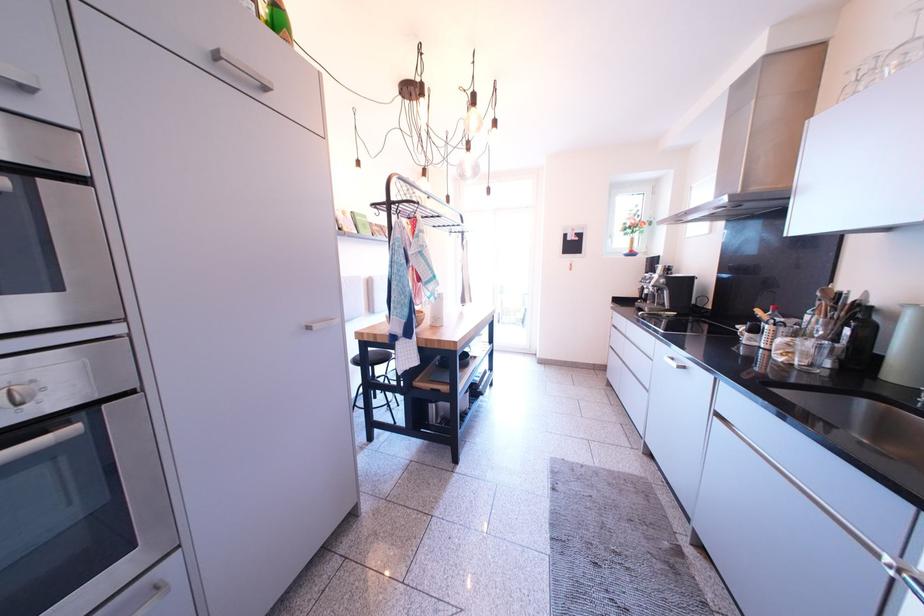
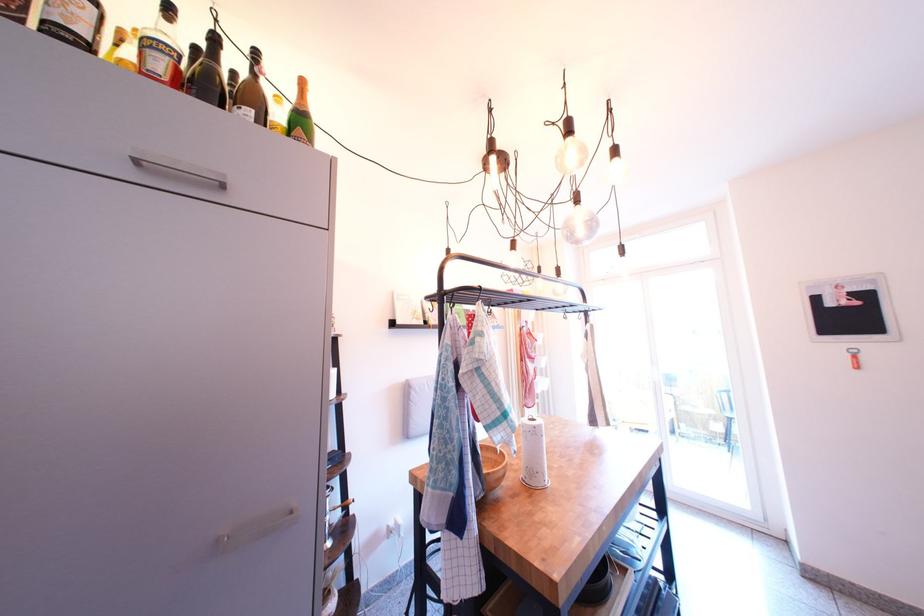
Where in the second image is the point corresponding to point (477, 107) from the first image?

(567, 140)